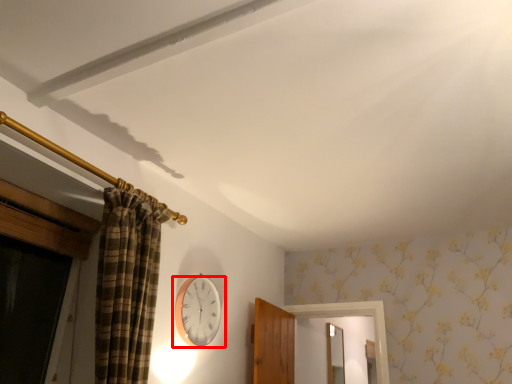
Question: Observing the image, what is the correct spatial positioning of wall clock (annotated by the red box) in reference to mirror?

Choices:
 (A) right
 (B) left

Answer: (B)